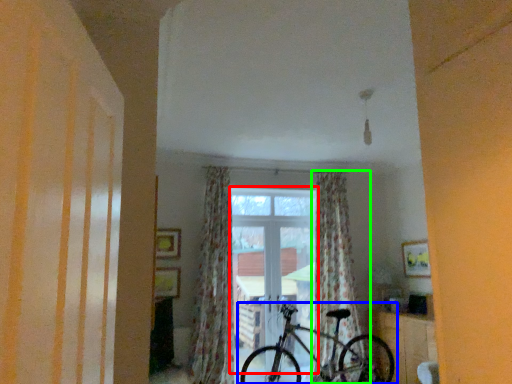
Question: Which is nearer to the window (highlighted by a red box)? bicycle (highlighted by a blue box) or curtain (highlighted by a green box).

Choices:
 (A) bicycle
 (B) curtain

Answer: (B)